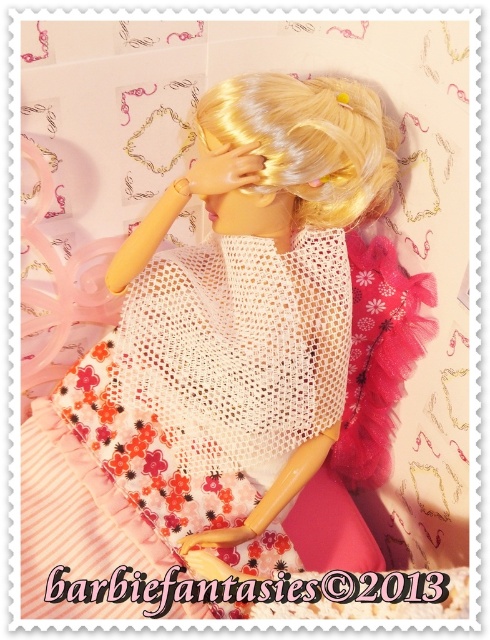
Looking at the doll in the image, which object is bigger between the white mesh dress at center and the blonde silky hair at center?

The white mesh dress at center is larger in size than the blonde silky hair at center.

Looking at the doll in the image, which object is positioned closer to the front from your perspective? The white mesh dress at center or the blonde silky hair at center?

The white mesh dress at center is closer to the front because the blonde silky hair at center is behind it.

Looking at the doll in the image, which object is positioned to the left of the other between the white mesh dress at center and the blonde silky hair at center?

The white mesh dress at center is to the left of the blonde silky hair at center.